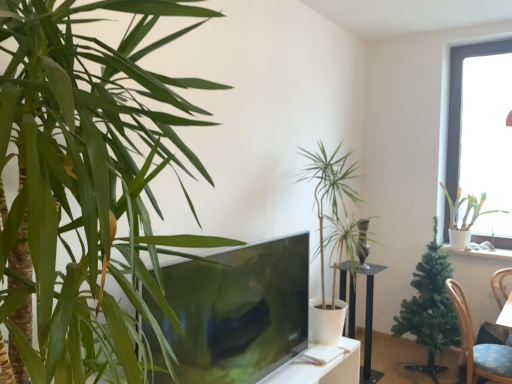
Question: From the image's perspective, is green leafy plant at left, the 4th houseplant from the back, on top of blue fabric chair at lower right?

Choices:
 (A) yes
 (B) no

Answer: (A)

Question: Is green leafy plant at left, the 4th houseplant from the back, thinner than blue fabric chair at lower right?

Choices:
 (A) no
 (B) yes

Answer: (A)

Question: Is green leafy plant at left, the 4th houseplant from the back, to the right of blue fabric chair at lower right from the viewer's perspective?

Choices:
 (A) yes
 (B) no

Answer: (B)

Question: Could you tell me if green leafy plant at left, which is the 1th houseplant in left-to-right order, is facing blue fabric chair at lower right?

Choices:
 (A) no
 (B) yes

Answer: (A)

Question: Is blue fabric chair at lower right a part of green leafy plant at left, which is the 1th houseplant in left-to-right order?

Choices:
 (A) no
 (B) yes

Answer: (A)

Question: Are green leafy plant at left, positioned as the fourth houseplant in right-to-left order, and blue fabric chair at lower right beside each other?

Choices:
 (A) yes
 (B) no

Answer: (B)

Question: Is transparent glass window at upper right taller than green leafy plant at left, positioned as the fourth houseplant in right-to-left order?

Choices:
 (A) no
 (B) yes

Answer: (B)

Question: From the image's perspective, is transparent glass window at upper right located beneath green leafy plant at left, the 1th houseplant from the front?

Choices:
 (A) yes
 (B) no

Answer: (B)

Question: Is transparent glass window at upper right at the left side of green leafy plant at left, positioned as the fourth houseplant in right-to-left order?

Choices:
 (A) no
 (B) yes

Answer: (A)

Question: Does transparent glass window at upper right appear on the right side of green leafy plant at left, positioned as the fourth houseplant in right-to-left order?

Choices:
 (A) yes
 (B) no

Answer: (A)

Question: Is transparent glass window at upper right positioned far away from green leafy plant at left, the 1th houseplant from the front?

Choices:
 (A) no
 (B) yes

Answer: (B)

Question: Is the depth of transparent glass window at upper right less than that of green leafy plant at left, which is the 1th houseplant in left-to-right order?

Choices:
 (A) no
 (B) yes

Answer: (A)

Question: Can we say transparent glass window at upper right lies outside green leafy plant at center, which appears as the 2th houseplant when viewed from the left?

Choices:
 (A) yes
 (B) no

Answer: (A)